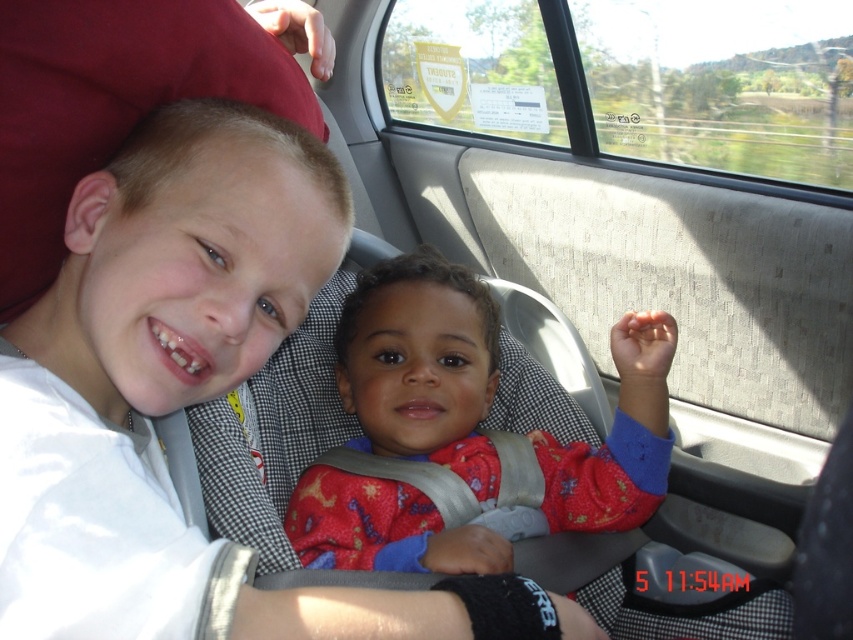
Question: Where is red fabric baby car seat at center located in relation to matte white shirt at upper left in the image?

Choices:
 (A) left
 (B) right

Answer: (B)

Question: Which point is closer to the camera?

Choices:
 (A) red fabric baby car seat at center
 (B) matte white shirt at upper left

Answer: (B)

Question: Does red fabric baby car seat at center have a greater width compared to matte white shirt at upper left?

Choices:
 (A) yes
 (B) no

Answer: (A)

Question: Can you confirm if red fabric baby car seat at center is positioned above matte white shirt at upper left?

Choices:
 (A) no
 (B) yes

Answer: (A)